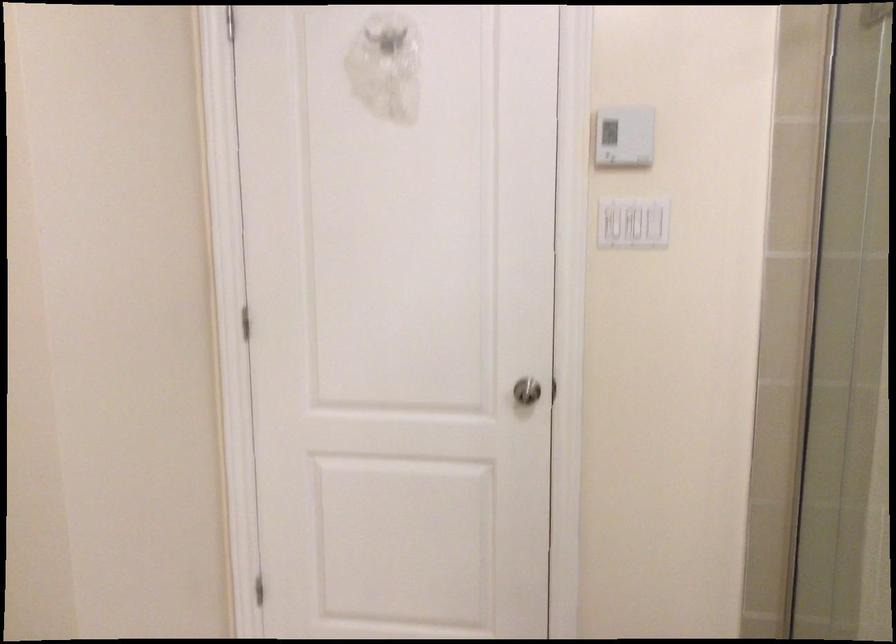
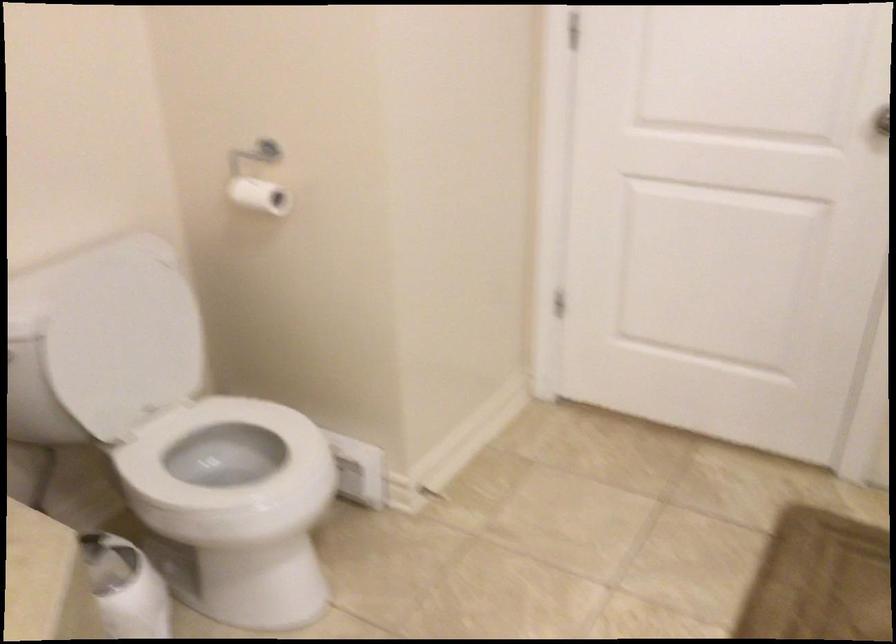
Find the pixel in the second image that matches (526,401) in the first image.

(879, 131)